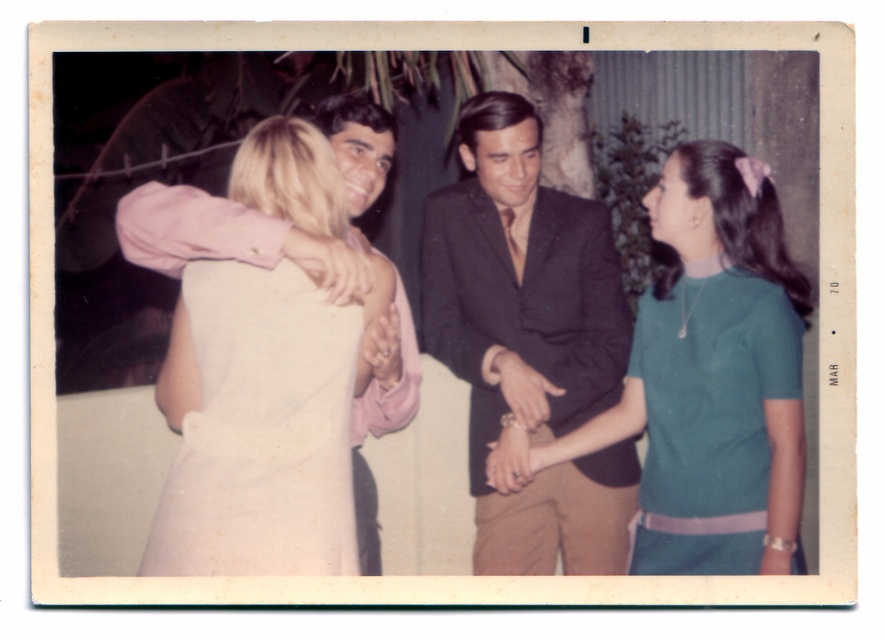
Question: Which of the following is the farthest from the observer?

Choices:
 (A) pos(759,401)
 (B) pos(342,456)
 (C) pos(489,157)

Answer: (C)

Question: Which point appears closest to the camera in this image?

Choices:
 (A) (210, 490)
 (B) (797, 506)
 (C) (755, 394)
 (D) (587, 205)

Answer: (A)

Question: Is dark brown suit at center smaller than teal knitted dress at right?

Choices:
 (A) no
 (B) yes

Answer: (A)

Question: Which object is farther from the camera taking this photo?

Choices:
 (A) dark brown suit at center
 (B) green knit dress at center
 (C) teal knitted dress at right

Answer: (A)

Question: Does dark brown suit at center appear under teal knitted dress at right?

Choices:
 (A) yes
 (B) no

Answer: (B)

Question: Can you confirm if dark brown suit at center is thinner than teal knitted dress at right?

Choices:
 (A) no
 (B) yes

Answer: (A)